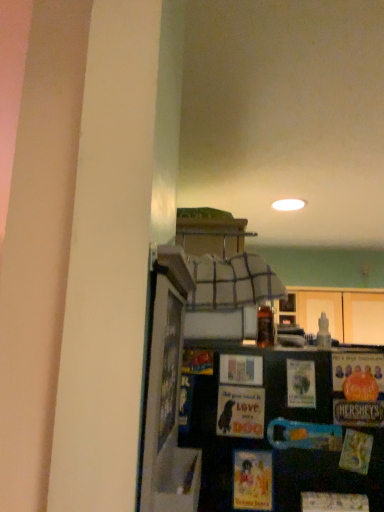
Image resolution: width=384 pixels, height=512 pixels. What do you see at coordinates (323, 332) in the screenshot? I see `translucent glass bottle at upper center` at bounding box center [323, 332].

Locate an element on the screen. The width and height of the screenshot is (384, 512). matte paper postcard at center, the 2th postcard in the left-to-right sequence is located at coordinates (301, 384).

Locate an element on the screen. This screenshot has height=512, width=384. translucent glass bottle at upper center is located at coordinates (323, 332).

Which is less distant, (309, 391) or (317, 334)?

The point (309, 391) is in front.

Is matte paper postcard at center, the 2th postcard in the left-to-right sequence, to the left or to the right of translucent glass bottle at upper center in the image?

In the image, matte paper postcard at center, the 2th postcard in the left-to-right sequence, appears on the left side of translucent glass bottle at upper center.

Consider the image. Considering the sizes of matte paper postcard at center, the 2th postcard in the left-to-right sequence, and translucent glass bottle at upper center in the image, is matte paper postcard at center, the 2th postcard in the left-to-right sequence, taller or shorter than translucent glass bottle at upper center?

In the image, matte paper postcard at center, the 2th postcard in the left-to-right sequence, appears to be taller than translucent glass bottle at upper center.

Locate an element on the screen. This screenshot has width=384, height=512. postcard below the matte paper postcard at center, marked as the 1th postcard in a right-to-left arrangement (from a real-world perspective) is located at coordinates (240, 411).

Is point (219, 415) positioned in front of point (306, 376)?

Yes, point (219, 415) is closer to viewer.

Who is more distant, matte paper postcard at center, which is the 2th postcard in right-to-left order, or matte paper postcard at center, the 2th postcard in the left-to-right sequence?

matte paper postcard at center, the 2th postcard in the left-to-right sequence.

Does translucent glass bottle at upper center turn towards matte paper postcard at center, which is the 2th postcard in right-to-left order?

No, translucent glass bottle at upper center does not turn towards matte paper postcard at center, which is the 2th postcard in right-to-left order.

In the scene shown: Is translucent glass bottle at upper center touching matte paper postcard at center, arranged as the 1th postcard when viewed from the left?

translucent glass bottle at upper center is not next to matte paper postcard at center, arranged as the 1th postcard when viewed from the left, and they're not touching.

How distant is translucent glass bottle at upper center from matte paper postcard at center, which is the 2th postcard in right-to-left order?

translucent glass bottle at upper center and matte paper postcard at center, which is the 2th postcard in right-to-left order, are 41.23 centimeters apart from each other.

Who is taller, translucent glass bottle at upper center or matte paper postcard at center, arranged as the 1th postcard when viewed from the left?

matte paper postcard at center, arranged as the 1th postcard when viewed from the left, is taller.

In terms of size, does matte paper postcard at center, marked as the 1th postcard in a right-to-left arrangement, appear bigger or smaller than matte paper postcard at center, which is the 2th postcard in right-to-left order?

Considering their sizes, matte paper postcard at center, marked as the 1th postcard in a right-to-left arrangement, takes up less space than matte paper postcard at center, which is the 2th postcard in right-to-left order.

In the scene shown: From a real-world perspective, is matte paper postcard at center, the 2th postcard in the left-to-right sequence, below matte paper postcard at center, arranged as the 1th postcard when viewed from the left?

No.

Does matte paper postcard at center, marked as the 1th postcard in a right-to-left arrangement, have a greater width compared to matte paper postcard at center, arranged as the 1th postcard when viewed from the left?

Yes, matte paper postcard at center, marked as the 1th postcard in a right-to-left arrangement, is wider than matte paper postcard at center, arranged as the 1th postcard when viewed from the left.

In the scene shown: From the image's perspective, is matte paper postcard at center, marked as the 1th postcard in a right-to-left arrangement, above or below matte paper postcard at center, arranged as the 1th postcard when viewed from the left?

matte paper postcard at center, marked as the 1th postcard in a right-to-left arrangement, is situated higher than matte paper postcard at center, arranged as the 1th postcard when viewed from the left, in the image.

What's the angular difference between translucent glass bottle at upper center and matte paper postcard at center, the 2th postcard in the left-to-right sequence,'s facing directions?

translucent glass bottle at upper center and matte paper postcard at center, the 2th postcard in the left-to-right sequence, are facing 90 degrees away from each other.

Considering the sizes of objects translucent glass bottle at upper center and matte paper postcard at center, the 2th postcard in the left-to-right sequence, in the image provided, who is smaller, translucent glass bottle at upper center or matte paper postcard at center, the 2th postcard in the left-to-right sequence,?

With smaller size is translucent glass bottle at upper center.

In the scene shown: Is translucent glass bottle at upper center wider or thinner than matte paper postcard at center, marked as the 1th postcard in a right-to-left arrangement?

translucent glass bottle at upper center is wider than matte paper postcard at center, marked as the 1th postcard in a right-to-left arrangement.

Does translucent glass bottle at upper center turn towards matte paper postcard at center, the 2th postcard in the left-to-right sequence?

No, translucent glass bottle at upper center is not oriented towards matte paper postcard at center, the 2th postcard in the left-to-right sequence.

Is matte paper postcard at center, arranged as the 1th postcard when viewed from the left, aimed at translucent glass bottle at upper center?

No, matte paper postcard at center, arranged as the 1th postcard when viewed from the left, is not oriented towards translucent glass bottle at upper center.

Considering the relative positions of matte paper postcard at center, which is the 2th postcard in right-to-left order, and translucent glass bottle at upper center in the image provided, is matte paper postcard at center, which is the 2th postcard in right-to-left order, to the left of translucent glass bottle at upper center from the viewer's perspective?

Correct, you'll find matte paper postcard at center, which is the 2th postcard in right-to-left order, to the left of translucent glass bottle at upper center.

Which object is closer to the camera taking this photo, matte paper postcard at center, which is the 2th postcard in right-to-left order, or translucent glass bottle at upper center?

matte paper postcard at center, which is the 2th postcard in right-to-left order.

Which is farther, (245, 433) or (320, 318)?

The point (320, 318) is behind.

Image resolution: width=384 pixels, height=512 pixels. I want to click on bottle that is above the matte paper postcard at center, the 2th postcard in the left-to-right sequence (from a real-world perspective), so click(x=323, y=332).

Identify the location of postcard behind the matte paper postcard at center, arranged as the 1th postcard when viewed from the left. The width and height of the screenshot is (384, 512). (301, 384).

Estimate the real-world distances between objects in this image. Which object is further from translucent glass bottle at upper center, matte paper postcard at center, marked as the 1th postcard in a right-to-left arrangement, or matte paper postcard at center, which is the 2th postcard in right-to-left order?

matte paper postcard at center, marked as the 1th postcard in a right-to-left arrangement, is further to translucent glass bottle at upper center.

From the image, which object appears to be farther from translucent glass bottle at upper center, matte paper postcard at center, which is the 2th postcard in right-to-left order, or matte paper postcard at center, the 2th postcard in the left-to-right sequence?

Among the two, matte paper postcard at center, the 2th postcard in the left-to-right sequence, is located further to translucent glass bottle at upper center.

Considering their positions, is matte paper postcard at center, arranged as the 1th postcard when viewed from the left, positioned closer to matte paper postcard at center, marked as the 1th postcard in a right-to-left arrangement, than translucent glass bottle at upper center?

The object closer to matte paper postcard at center, marked as the 1th postcard in a right-to-left arrangement, is matte paper postcard at center, arranged as the 1th postcard when viewed from the left.

Estimate the real-world distances between objects in this image. Which object is closer to matte paper postcard at center, marked as the 1th postcard in a right-to-left arrangement, translucent glass bottle at upper center or matte paper postcard at center, arranged as the 1th postcard when viewed from the left?

matte paper postcard at center, arranged as the 1th postcard when viewed from the left.

In the scene shown: Which object lies nearer to the anchor point matte paper postcard at center, which is the 2th postcard in right-to-left order, matte paper postcard at center, marked as the 1th postcard in a right-to-left arrangement, or translucent glass bottle at upper center?

The object closer to matte paper postcard at center, which is the 2th postcard in right-to-left order, is matte paper postcard at center, marked as the 1th postcard in a right-to-left arrangement.

Looking at the image, which one is located further to matte paper postcard at center, arranged as the 1th postcard when viewed from the left, translucent glass bottle at upper center or matte paper postcard at center, marked as the 1th postcard in a right-to-left arrangement?

Among the two, translucent glass bottle at upper center is located further to matte paper postcard at center, arranged as the 1th postcard when viewed from the left.

Where is `postcard situated between matte paper postcard at center, arranged as the 1th postcard when viewed from the left, and translucent glass bottle at upper center from left to right`? The height and width of the screenshot is (512, 384). postcard situated between matte paper postcard at center, arranged as the 1th postcard when viewed from the left, and translucent glass bottle at upper center from left to right is located at coordinates (301, 384).